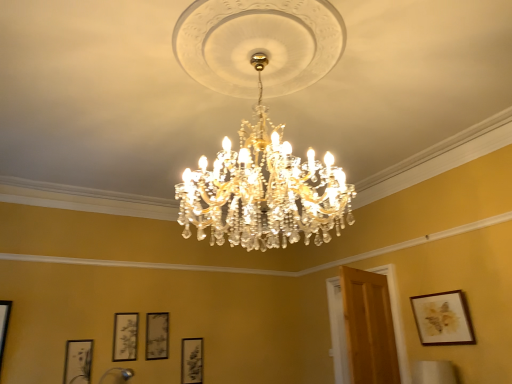
The height and width of the screenshot is (384, 512). What do you see at coordinates (125, 337) in the screenshot? I see `matte black picture frame at lower center, the third picture frame when ordered from back to front` at bounding box center [125, 337].

Find the location of a particular element. wooden framed artwork at upper right, the first picture frame positioned from the front is located at coordinates (443, 319).

Where is `matte black picture frame at lower center, arranged as the second picture frame when viewed from the right`? matte black picture frame at lower center, arranged as the second picture frame when viewed from the right is located at coordinates tap(192, 361).

Locate an element on the screen. This screenshot has width=512, height=384. matte black picture frame at lower left, which is the 2th picture frame from front to back is located at coordinates click(x=78, y=361).

Would you say metallic blue lamp at lower center, arranged as the second lamp when viewed from the front, is outside matte black picture frame at lower center, the 2th picture frame viewed from the back?

That's correct, metallic blue lamp at lower center, arranged as the second lamp when viewed from the front, is outside of matte black picture frame at lower center, the 2th picture frame viewed from the back.

From the image's perspective, is metallic blue lamp at lower center, which is the 1th lamp from back to front, above matte black picture frame at lower center, the fourth picture frame when ordered from front to back?

No, from the image's perspective, metallic blue lamp at lower center, which is the 1th lamp from back to front, is not above matte black picture frame at lower center, the fourth picture frame when ordered from front to back.

Looking at the image, does metallic blue lamp at lower center, which is the 1th lamp from back to front, seem bigger or smaller compared to matte black picture frame at lower center, the fourth picture frame when ordered from front to back?

metallic blue lamp at lower center, which is the 1th lamp from back to front, is bigger than matte black picture frame at lower center, the fourth picture frame when ordered from front to back.

Which object is positioned more to the right, metallic blue lamp at lower center, the first lamp positioned from the left, or matte black picture frame at lower center, which appears as the 3th picture frame when viewed from the left?

matte black picture frame at lower center, which appears as the 3th picture frame when viewed from the left.

Is matte black picture frame at lower left, acting as the first picture frame starting from the left, thinner than matte black picture frame at lower center, the fourth picture frame positioned from the right?

In fact, matte black picture frame at lower left, acting as the first picture frame starting from the left, might be wider than matte black picture frame at lower center, the fourth picture frame positioned from the right.

How far apart are matte black picture frame at lower left, placed as the fifth picture frame when sorted from right to left, and matte black picture frame at lower center, arranged as the second picture frame when viewed from the left?

They are 35.37 centimeters apart.

How different are the orientations of matte black picture frame at lower left, acting as the first picture frame starting from the left, and matte black picture frame at lower center, arranged as the second picture frame when viewed from the left, in degrees?

matte black picture frame at lower left, acting as the first picture frame starting from the left, and matte black picture frame at lower center, arranged as the second picture frame when viewed from the left, are facing 0.00585 degrees away from each other.

In the scene shown: From a real-world perspective, which is physically above, matte black picture frame at lower left, which is the 2th picture frame from front to back, or matte black picture frame at lower center, the third picture frame when ordered from back to front?

In real-world perspective, matte black picture frame at lower center, the third picture frame when ordered from back to front, is above.

Which object is positioned more to the right, matte black picture frame at lower left, which is the 2th picture frame from front to back, or matte black picture frame at lower center, which is the 4th picture frame from left to right?

From the viewer's perspective, matte black picture frame at lower center, which is the 4th picture frame from left to right, appears more on the right side.

Considering the positions of points (73, 371) and (184, 377), is point (73, 371) closer to camera compared to point (184, 377)?

Yes, point (73, 371) is in front of point (184, 377).

Considering the relative sizes of matte black picture frame at lower left, marked as the fourth picture frame in a back-to-front arrangement, and matte black picture frame at lower center, arranged as the second picture frame when viewed from the right, in the image provided, is matte black picture frame at lower left, marked as the fourth picture frame in a back-to-front arrangement, taller than matte black picture frame at lower center, arranged as the second picture frame when viewed from the right,?

No.

Which of these two, matte black picture frame at lower left, acting as the first picture frame starting from the left, or matte black picture frame at lower center, arranged as the second picture frame when viewed from the right, is bigger?

Bigger between the two is matte black picture frame at lower left, acting as the first picture frame starting from the left.

Is wooden framed artwork at upper right, the first picture frame positioned from the front, spatially inside matte black picture frame at lower center, the third picture frame when ordered from back to front, or outside of it?

wooden framed artwork at upper right, the first picture frame positioned from the front, is not inside matte black picture frame at lower center, the third picture frame when ordered from back to front, it's outside.

Based on the photo, considering the sizes of objects wooden framed artwork at upper right, which ranks as the 5th picture frame in back-to-front order, and matte black picture frame at lower center, the fourth picture frame positioned from the right, in the image provided, who is bigger, wooden framed artwork at upper right, which ranks as the 5th picture frame in back-to-front order, or matte black picture frame at lower center, the fourth picture frame positioned from the right,?

wooden framed artwork at upper right, which ranks as the 5th picture frame in back-to-front order, is bigger.

Considering the positions of objects wooden framed artwork at upper right, marked as the 1th picture frame in a right-to-left arrangement, and matte black picture frame at lower center, the third picture frame when ordered from back to front, in the image provided, who is in front, wooden framed artwork at upper right, marked as the 1th picture frame in a right-to-left arrangement, or matte black picture frame at lower center, the third picture frame when ordered from back to front,?

wooden framed artwork at upper right, marked as the 1th picture frame in a right-to-left arrangement.

From a real-world perspective, between wooden framed artwork at upper right, marked as the 1th picture frame in a right-to-left arrangement, and matte black picture frame at lower center, the fourth picture frame positioned from the right, who is vertically higher?

wooden framed artwork at upper right, marked as the 1th picture frame in a right-to-left arrangement, is physically above.

Is point (105, 380) closer or farther from the camera than point (134, 359)?

Point (105, 380) is closer to the camera than point (134, 359).

From a real-world perspective, who is located higher, metallic blue lamp at lower center, acting as the first lamp starting from the bottom, or matte black picture frame at lower center, the third picture frame when ordered from back to front?

matte black picture frame at lower center, the third picture frame when ordered from back to front, from a real-world perspective.

Is metallic blue lamp at lower center, which is counted as the 2th lamp, starting from the top, smaller than matte black picture frame at lower center, the third picture frame when ordered from back to front?

No.

Considering the sizes of objects matte black picture frame at lower left, marked as the fourth picture frame in a back-to-front arrangement, and clear crystal chandelier at center, positioned as the second lamp in bottom-to-top order, in the image provided, who is shorter, matte black picture frame at lower left, marked as the fourth picture frame in a back-to-front arrangement, or clear crystal chandelier at center, positioned as the second lamp in bottom-to-top order,?

matte black picture frame at lower left, marked as the fourth picture frame in a back-to-front arrangement, is shorter.

Consider the image. Is matte black picture frame at lower left, which is the 2th picture frame from front to back, positioned in front of clear crystal chandelier at center, which is the 2th lamp from left to right?

No, matte black picture frame at lower left, which is the 2th picture frame from front to back, is further to the viewer.

Locate an element on the screen. Image resolution: width=512 pixels, height=384 pixels. the 2nd lamp counting from the right of the matte black picture frame at lower left, which is the 2th picture frame from front to back is located at coordinates (262, 123).

Does matte black picture frame at lower left, marked as the fourth picture frame in a back-to-front arrangement, turn towards clear crystal chandelier at center, which is the 1th lamp in right-to-left order?

Yes, matte black picture frame at lower left, marked as the fourth picture frame in a back-to-front arrangement, is aimed at clear crystal chandelier at center, which is the 1th lamp in right-to-left order.

From the picture: Which object is thinner, wooden framed artwork at upper right, the first picture frame positioned from the front, or clear crystal chandelier at center, which is the 2th lamp from left to right?

Thinner between the two is wooden framed artwork at upper right, the first picture frame positioned from the front.

From the picture: Is wooden framed artwork at upper right, which is counted as the fifth picture frame, starting from the left, aimed at clear crystal chandelier at center, positioned as the second lamp in bottom-to-top order?

Yes.

Is wooden framed artwork at upper right, the first picture frame positioned from the front, positioned beyond the bounds of clear crystal chandelier at center, positioned as the second lamp in bottom-to-top order?

Indeed, wooden framed artwork at upper right, the first picture frame positioned from the front, is completely outside clear crystal chandelier at center, positioned as the second lamp in bottom-to-top order.

This screenshot has height=384, width=512. In order to click on picture frame that is the 2nd one when counting rightward from the metallic blue lamp at lower center, acting as the first lamp starting from the bottom in this screenshot , I will do `click(157, 335)`.

Find the location of `picture frame located on the left of matte black picture frame at lower center, which ranks as the third picture frame in front-to-back order`. picture frame located on the left of matte black picture frame at lower center, which ranks as the third picture frame in front-to-back order is located at coordinates (78, 361).

Looking at this image, which object lies nearer to the anchor point matte black picture frame at lower center, the third picture frame when ordered from back to front, matte black picture frame at lower center, positioned as the third picture frame in right-to-left order, or metallic blue lamp at lower center, which is counted as the 2th lamp, starting from the top?

matte black picture frame at lower center, positioned as the third picture frame in right-to-left order, lies closer to matte black picture frame at lower center, the third picture frame when ordered from back to front, than the other object.

Which object lies further to the anchor point clear crystal chandelier at center, which ranks as the 2th lamp in back-to-front order, matte black picture frame at lower left, acting as the first picture frame starting from the left, or matte black picture frame at lower center, the fourth picture frame when ordered from front to back?

matte black picture frame at lower left, acting as the first picture frame starting from the left, lies further to clear crystal chandelier at center, which ranks as the 2th lamp in back-to-front order, than the other object.

Which object lies nearer to the anchor point matte black picture frame at lower center, the fourth picture frame positioned from the right, wooden framed artwork at upper right, which ranks as the 5th picture frame in back-to-front order, or matte black picture frame at lower center, the fourth picture frame when ordered from front to back?

Among the two, matte black picture frame at lower center, the fourth picture frame when ordered from front to back, is located nearer to matte black picture frame at lower center, the fourth picture frame positioned from the right.

Estimate the real-world distances between objects in this image. Which object is further from wooden framed artwork at upper right, which ranks as the 5th picture frame in back-to-front order, matte black picture frame at lower center, positioned as the first picture frame in back-to-front order, or clear crystal chandelier at center, which ranks as the 2th lamp in back-to-front order?

matte black picture frame at lower center, positioned as the first picture frame in back-to-front order, is positioned further to the anchor wooden framed artwork at upper right, which ranks as the 5th picture frame in back-to-front order.

Estimate the real-world distances between objects in this image. Which object is further from clear crystal chandelier at center, which ranks as the 2th lamp in back-to-front order, matte black picture frame at lower center, which ranks as the third picture frame in front-to-back order, or wooden framed artwork at upper right, which is counted as the fifth picture frame, starting from the left?

matte black picture frame at lower center, which ranks as the third picture frame in front-to-back order, is further to clear crystal chandelier at center, which ranks as the 2th lamp in back-to-front order.

Which object lies nearer to the anchor point matte black picture frame at lower center, the 5th picture frame in the front-to-back sequence, wooden framed artwork at upper right, which is counted as the fifth picture frame, starting from the left, or clear crystal chandelier at center, which ranks as the 2th lamp in back-to-front order?

wooden framed artwork at upper right, which is counted as the fifth picture frame, starting from the left, is positioned closer to the anchor matte black picture frame at lower center, the 5th picture frame in the front-to-back sequence.

Which object lies nearer to the anchor point matte black picture frame at lower center, positioned as the third picture frame in right-to-left order, matte black picture frame at lower center, which is the 4th picture frame from left to right, or clear crystal chandelier at center, placed as the 1th lamp when sorted from top to bottom?

matte black picture frame at lower center, which is the 4th picture frame from left to right, is closer to matte black picture frame at lower center, positioned as the third picture frame in right-to-left order.

From the picture: From the image, which object appears to be farther from clear crystal chandelier at center, which is the 2th lamp from left to right, matte black picture frame at lower center, the 2th picture frame viewed from the back, or matte black picture frame at lower left, marked as the fourth picture frame in a back-to-front arrangement?

Among the two, matte black picture frame at lower left, marked as the fourth picture frame in a back-to-front arrangement, is located further to clear crystal chandelier at center, which is the 2th lamp from left to right.

Locate an element on the screen. picture frame situated between matte black picture frame at lower center, which ranks as the third picture frame in front-to-back order, and matte black picture frame at lower center, the 5th picture frame in the front-to-back sequence, from left to right is located at coordinates (157, 335).

You are a GUI agent. You are given a task and a screenshot of the screen. Output one action in this format:
    pyautogui.click(x=<x>, y=<y>)
    Task: Click on the lamp located between clear crystal chandelier at center, the 1th lamp when ordered from front to back, and matte black picture frame at lower center, the 2th picture frame viewed from the back, in the depth direction
    
    Given the screenshot: What is the action you would take?
    117,375

I want to click on picture frame between matte black picture frame at lower center, positioned as the third picture frame in right-to-left order, and wooden framed artwork at upper right, which ranks as the 5th picture frame in back-to-front order, from left to right, so (192, 361).

Identify the location of lamp situated between matte black picture frame at lower left, acting as the first picture frame starting from the left, and matte black picture frame at lower center, which appears as the 3th picture frame when viewed from the left, from left to right. The image size is (512, 384). (117, 375).